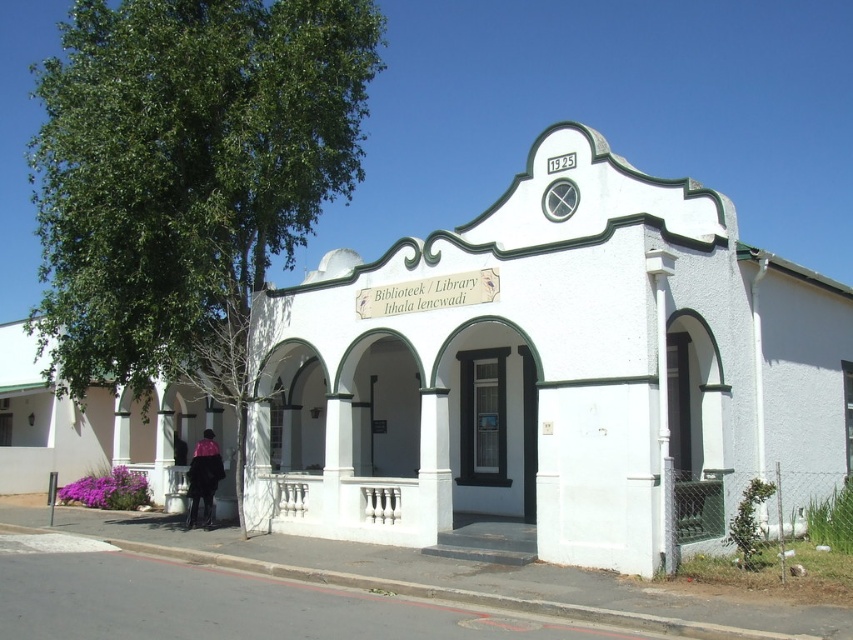
You are standing in front of the Biblioteek Library building. You see the white painted wall at center and the velvet purple coat at lower left. Which object is wider?

The white painted wall at center is wider than the velvet purple coat at lower left according to the description.

You are standing in front of the building and notice a point marked at coordinates (550, 376). What is located at that point?

The point at coordinates (550, 376) is occupied by the white painted wall at center.